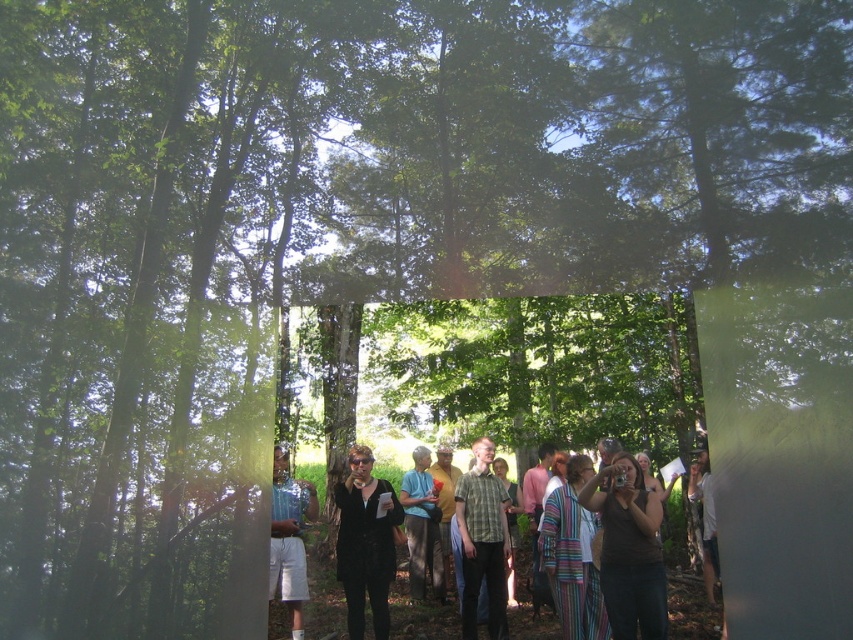
You are part of a photography team and need to position two subjects wearing the black matte blazer at center and the green plaid shirt at center. Based on the scene description, which subject should be placed to the left to align with the existing setup?

The black matte blazer at center should be placed to the left of the green plaid shirt at center since it is already positioned on the left side of the green plaid shirt at center in the scene.

You are a photographer trying to capture a shot of the group. You notice the green plaid shirt at center and the light blue denim shorts at left. Which of these two items is positioned more to the right side of the scene?

The green plaid shirt at center is positioned more to the right side of the scene compared to the light blue denim shorts at left.